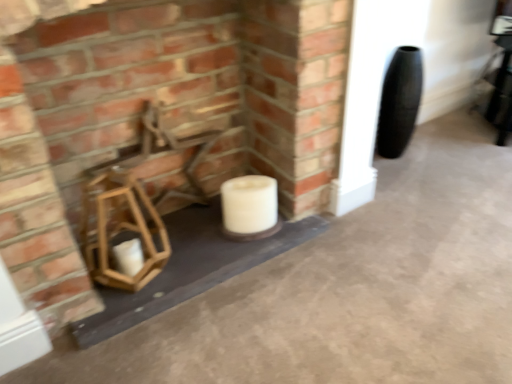
Question: Can you confirm if wooden chair at center is bigger than smooth concrete at center?

Choices:
 (A) no
 (B) yes

Answer: (A)

Question: Is wooden chair at center to the right of smooth concrete at center from the viewer's perspective?

Choices:
 (A) yes
 (B) no

Answer: (B)

Question: Is wooden chair at center aimed at smooth concrete at center?

Choices:
 (A) yes
 (B) no

Answer: (B)

Question: Does wooden chair at center have a greater height compared to smooth concrete at center?

Choices:
 (A) yes
 (B) no

Answer: (A)

Question: From a real-world perspective, is wooden chair at center below smooth concrete at center?

Choices:
 (A) no
 (B) yes

Answer: (A)

Question: Does wooden chair at center have a smaller size compared to smooth concrete at center?

Choices:
 (A) no
 (B) yes

Answer: (B)

Question: Are white matte candle at center and wooden lantern at lower left making contact?

Choices:
 (A) yes
 (B) no

Answer: (B)

Question: Is white matte candle at center smaller than wooden lantern at lower left?

Choices:
 (A) no
 (B) yes

Answer: (B)

Question: Is white matte candle at center positioned far away from wooden lantern at lower left?

Choices:
 (A) no
 (B) yes

Answer: (A)

Question: Is white matte candle at center closer to the viewer compared to wooden lantern at lower left?

Choices:
 (A) no
 (B) yes

Answer: (A)

Question: Is white matte candle at center further to camera compared to wooden lantern at lower left?

Choices:
 (A) yes
 (B) no

Answer: (A)

Question: Is wooden lantern at lower left surrounded by white matte candle at center?

Choices:
 (A) yes
 (B) no

Answer: (B)

Question: Does wooden lantern at lower left have a smaller size compared to smooth concrete at center?

Choices:
 (A) yes
 (B) no

Answer: (B)